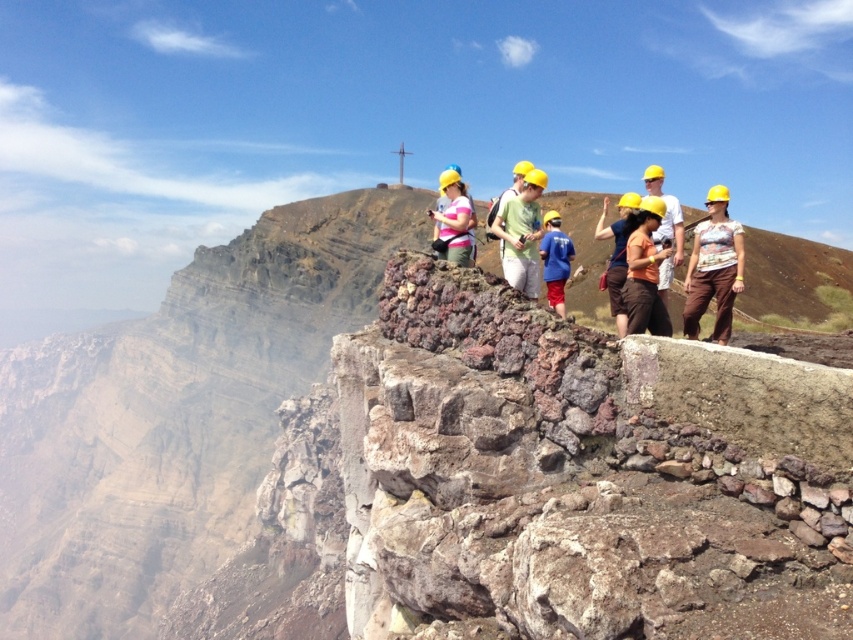
Question: Which point is closer to the camera taking this photo?

Choices:
 (A) (466, 259)
 (B) (556, 262)
 (C) (640, 218)
 (D) (712, 272)

Answer: (C)

Question: Which is farther from the brown rocky mountain at upper center?

Choices:
 (A) pink fabric shirt at center
 (B) blue fabric shirt at center

Answer: (B)

Question: Is pink fabric shirt at center wider than yellow hard hat at center?

Choices:
 (A) yes
 (B) no

Answer: (B)

Question: Can you confirm if brown fabric shirt at center is positioned to the left of blue fabric shirt at center?

Choices:
 (A) yes
 (B) no

Answer: (B)

Question: Which point is farther from the camera taking this photo?

Choices:
 (A) (527, 193)
 (B) (596, 225)
 (C) (630, 260)
 (D) (440, 236)

Answer: (B)

Question: Is brown rocky mountain at upper center to the left of matte yellow hard hat at center from the viewer's perspective?

Choices:
 (A) yes
 (B) no

Answer: (A)